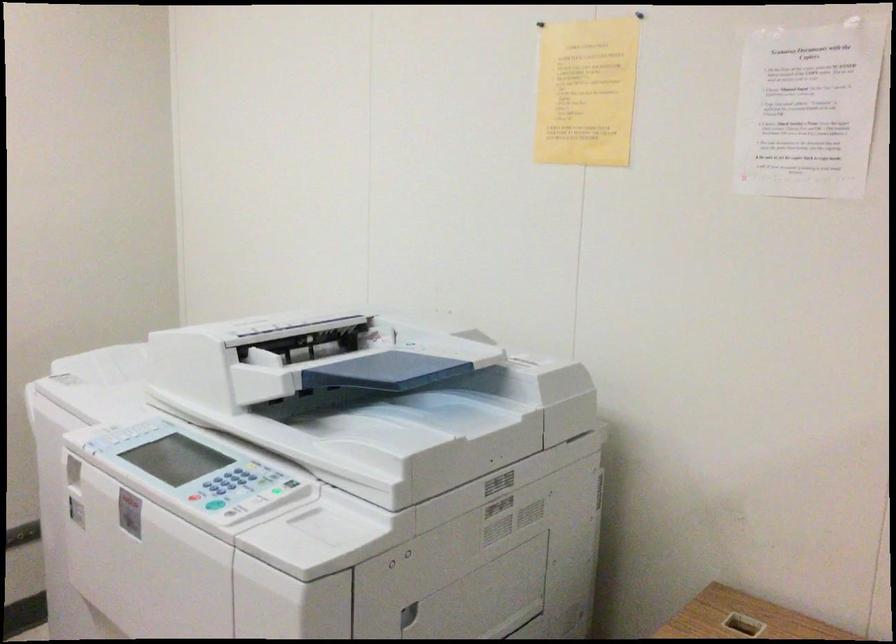
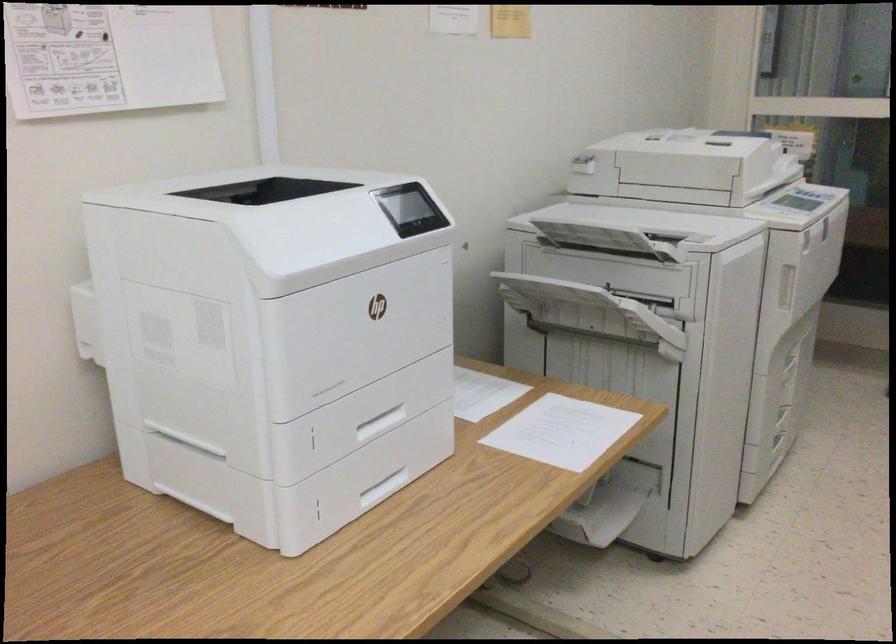
The first image is from the beginning of the video and the second image is from the end. How did the camera likely rotate when shooting the video?

The rotation direction of the camera is right-down.